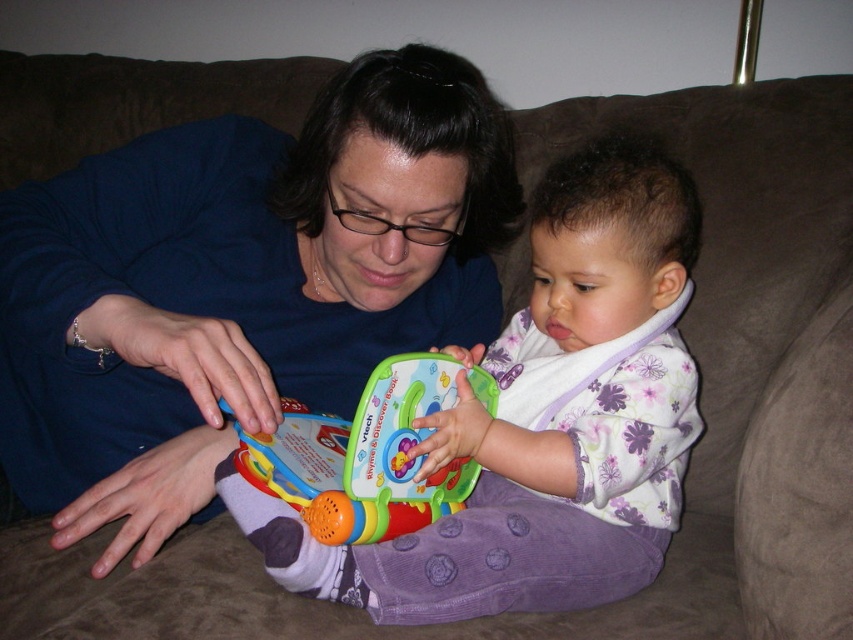
You are a parent trying to hand your child a new toy. The blue fabric at center is your shirt, and the multicolored plastic toy at center is the toy you want to give. Can you reach the toy without moving your shirt?

The blue fabric at center and multicolored plastic toy at center are 6.52 inches apart from each other. Since the distance is manageable for an adult hand, you can likely reach the multicolored plastic toy at center without moving the blue fabric at center.